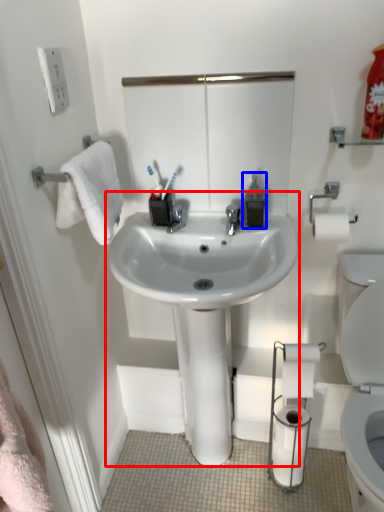
Question: Which point is further to the camera, sink (highlighted by a red box) or soap dispenser (highlighted by a blue box)?

Choices:
 (A) sink
 (B) soap dispenser

Answer: (B)